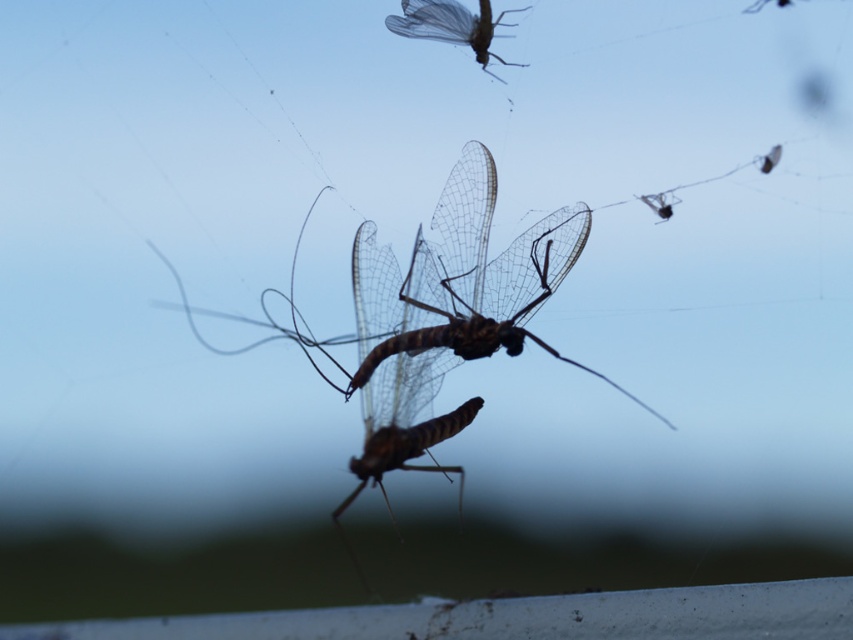
Between translucent brown insect at center and translucent brown dragonfly at upper right, which one is positioned higher?

translucent brown dragonfly at upper right is above.

Between point (396, 353) and point (669, 212), which one is positioned behind?

Point (669, 212)

What do you see at coordinates (439, 316) in the screenshot? I see `translucent brown insect at center` at bounding box center [439, 316].

Find the location of a particular element. translucent brown insect at center is located at coordinates (439, 316).

Can you confirm if translucent brown insect at center is positioned above translucent winged insect at upper center?

No, translucent brown insect at center is not above translucent winged insect at upper center.

Describe the element at coordinates (439, 316) in the screenshot. Image resolution: width=853 pixels, height=640 pixels. I see `translucent brown insect at center` at that location.

You are a GUI agent. You are given a task and a screenshot of the screen. Output one action in this format:
    pyautogui.click(x=<x>, y=<y>)
    Task: Click on the translucent brown insect at center
    The width and height of the screenshot is (853, 640).
    Given the screenshot: What is the action you would take?
    pyautogui.click(x=439, y=316)

How distant is translucent winged insect at upper center from translucent brown dragonfly at upper right?

translucent winged insect at upper center and translucent brown dragonfly at upper right are 10.82 inches apart.

Which is in front, point (494, 76) or point (668, 212)?

Point (668, 212)

Locate an element on the screen. translucent winged insect at upper center is located at coordinates (451, 26).